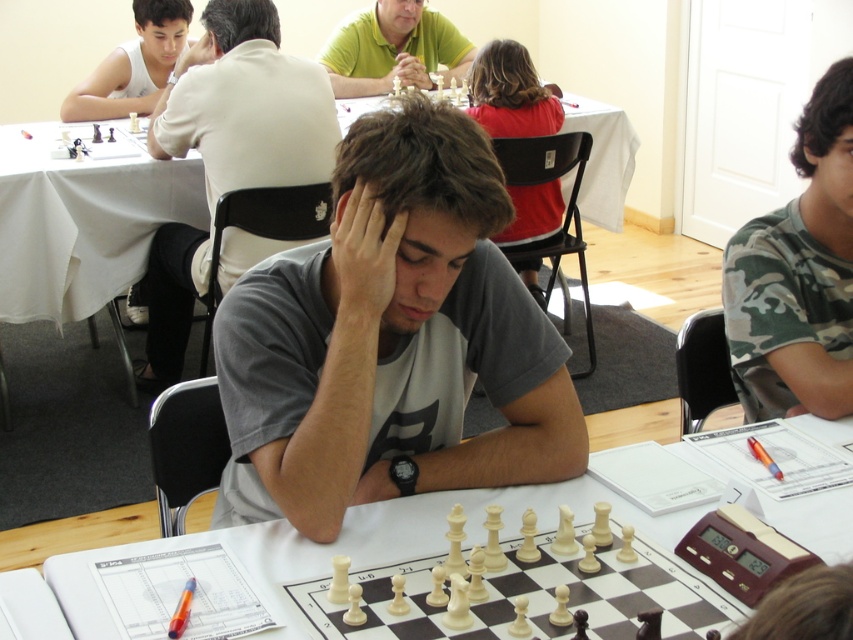
You are a photographer in the tournament. You want to take a photo of the ivory wood chess set at center and the matte green polo shirt at center. Which object should you focus on first if you want the one closer to the camera to be sharp?

The ivory wood chess set at center is positioned under the matte green polo shirt at center, meaning the ivory wood chess set is closer to the camera. Therefore, you should focus on the ivory wood chess set at center first to ensure it is sharp.

You are a photographer trying to capture a closeup of the ivory wood chess set at center. The camera you are using has a minimum focusing distance of 1 meter. Can you take the photo without moving the camera or the chess set?

The ivory wood chess set at center and camera are 1.14 meters apart, so yes, you can take the photo because the distance between them is greater than the camera minimum focusing distance of 1 meter.